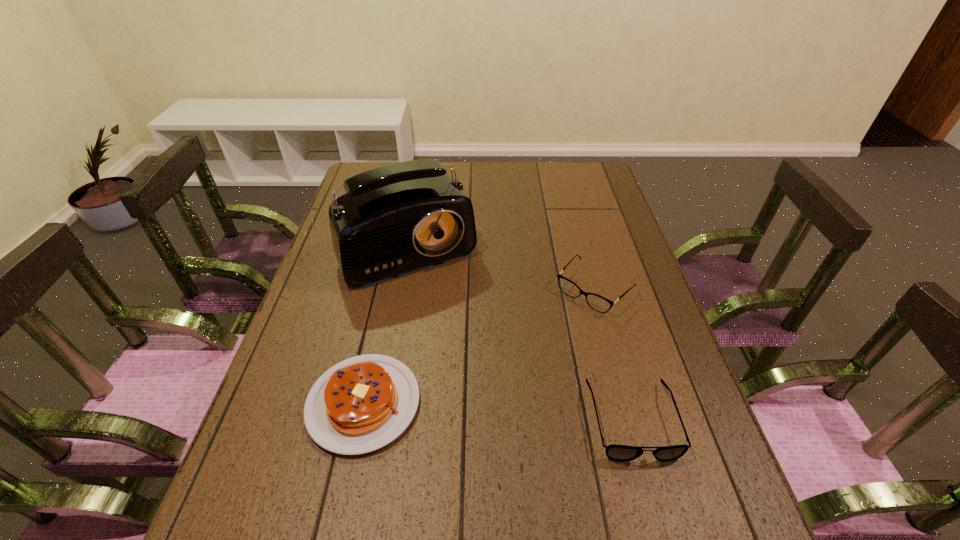
You are a GUI agent. You are given a task and a screenshot of the screen. Output one action in this format:
    pyautogui.click(x=<x>, y=<y>)
    Task: Click on the pancake
    The height and width of the screenshot is (540, 960).
    Given the screenshot: What is the action you would take?
    pyautogui.click(x=363, y=403)

You are a GUI agent. You are given a task and a screenshot of the screen. Output one action in this format:
    pyautogui.click(x=<x>, y=<y>)
    Task: Click on the nearer spectacles
    This screenshot has height=540, width=960.
    Given the screenshot: What is the action you would take?
    pyautogui.click(x=622, y=453)

You are a GUI agent. You are given a task and a screenshot of the screen. Output one action in this format:
    pyautogui.click(x=<x>, y=<y>)
    Task: Click on the tallest object
    
    Given the screenshot: What is the action you would take?
    pyautogui.click(x=396, y=219)

The width and height of the screenshot is (960, 540). Find the location of `the farther spectacles`. the farther spectacles is located at coordinates (568, 287).

The width and height of the screenshot is (960, 540). Find the location of `vacant space situated on the right of the pancake`. vacant space situated on the right of the pancake is located at coordinates (596, 403).

Where is `free space located on the front-facing side of the radio receiver`? free space located on the front-facing side of the radio receiver is located at coordinates (453, 319).

I want to click on free space located on the front-facing side of the radio receiver, so click(x=497, y=396).

Locate an element on the screen. vacant space situated 0.110m on the front-facing side of the radio receiver is located at coordinates (450, 313).

Locate an element on the screen. vacant space located 0.380m on the front-facing side of the farther spectacles is located at coordinates (480, 411).

Where is `free region located on the front-facing side of the farther spectacles`? free region located on the front-facing side of the farther spectacles is located at coordinates (534, 353).